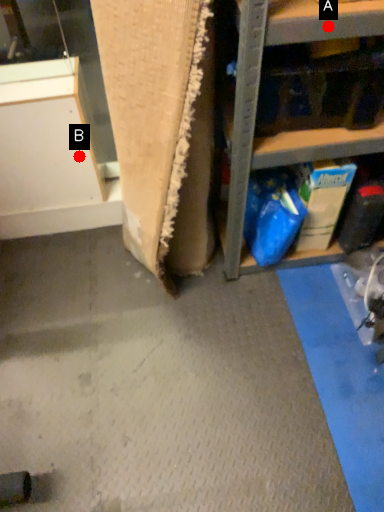
Question: Two points are circled on the image, labeled by A and B beside each circle. Among these points, which one is farthest from the camera?

Choices:
 (A) A is further
 (B) B is further

Answer: (B)